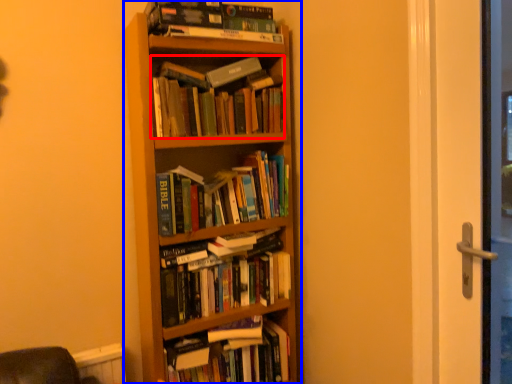
Question: Which object appears closest to the camera in this image, book (highlighted by a red box) or bookcase (highlighted by a blue box)?

Choices:
 (A) book
 (B) bookcase

Answer: (B)